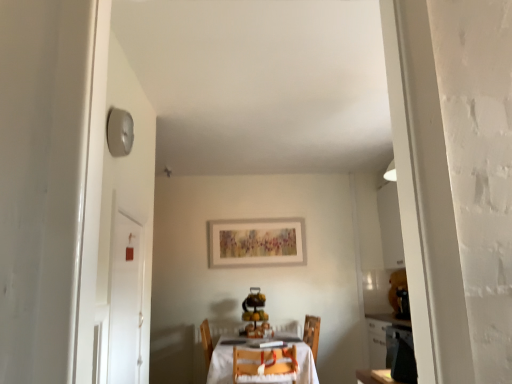
Question: Looking at the image, does white wooden table at center seem bigger or smaller compared to wooden chair at center?

Choices:
 (A) small
 (B) big

Answer: (B)

Question: From the image's perspective, is white wooden table at center located above or below wooden chair at center?

Choices:
 (A) below
 (B) above

Answer: (A)

Question: Based on their relative distances, which object is farther from the wooden chair at center?

Choices:
 (A) white wooden table at center
 (B) white glossy door at left

Answer: (B)

Question: Based on their relative distances, which object is farther from the white glossy door at left?

Choices:
 (A) wooden chair at center
 (B) white wooden table at center

Answer: (B)